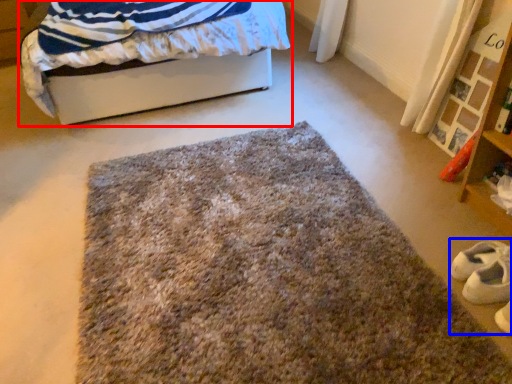
Question: Which point is closer to the camera, bed (highlighted by a red box) or shoe (highlighted by a blue box)?

Choices:
 (A) bed
 (B) shoe

Answer: (B)